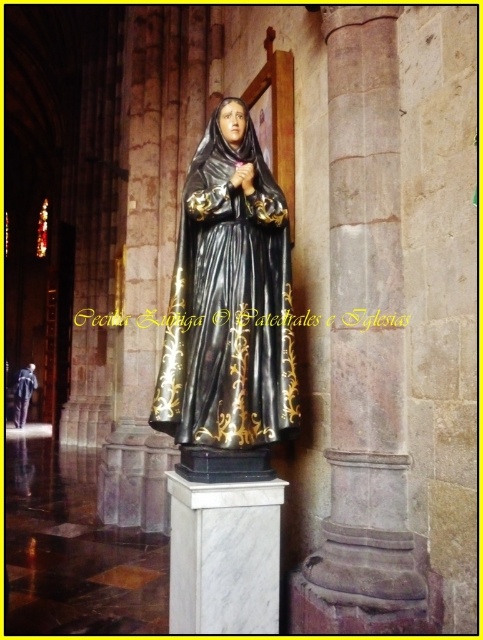
How distant is smooth stone column at center from black glossy robe at center?

9.18 meters

Between smooth stone column at center and black glossy robe at center, which one appears on the left side from the viewer's perspective?

black glossy robe at center is more to the left.

Image resolution: width=483 pixels, height=640 pixels. Describe the element at coordinates (364, 348) in the screenshot. I see `smooth stone column at center` at that location.

You are a GUI agent. You are given a task and a screenshot of the screen. Output one action in this format:
    pyautogui.click(x=<x>, y=<y>)
    Task: Click on the smooth stone column at center
    
    Given the screenshot: What is the action you would take?
    pyautogui.click(x=364, y=348)

Between point (264, 248) and point (199, 630), which one is positioned behind?

Point (264, 248)

Is point (218, 204) positioned behind point (232, 616)?

That is True.

At what (x,y) coordinates should I click in order to perform the action: click on black glossy statue at center. Please return your answer as a coordinate pair (x, y). Looking at the image, I should click on coord(228,301).

Measure the distance from white marble pedestal at center to black glossy robe at center.

white marble pedestal at center and black glossy robe at center are 9.09 meters apart.

Between point (181, 595) and point (33, 388), which one is positioned in front?

Point (181, 595) is in front.

The image size is (483, 640). What are the coordinates of `white marble pedestal at center` in the screenshot? It's located at (224, 556).